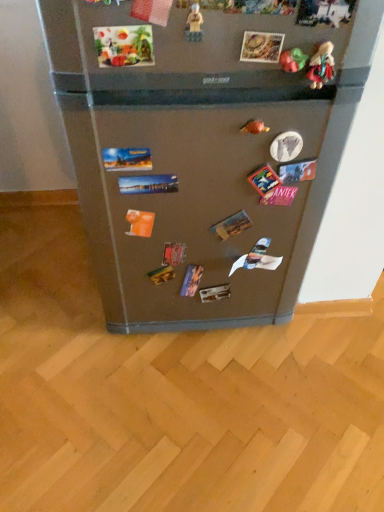
Question: From the image's perspective, is translucent plastic toy at upper center, the first toy positioned from the front, above or below matte plastic doll at upper right, which ranks as the 1th toy in right-to-left order?

Choices:
 (A) above
 (B) below

Answer: (A)

Question: Is point (195, 22) closer or farther from the camera than point (317, 64)?

Choices:
 (A) closer
 (B) farther

Answer: (A)

Question: Estimate the real-world distances between objects in this image. Which object is closer to the rubber duck at upper right, marked as the 1th toy in a back-to-front arrangement?

Choices:
 (A) matte plastic toy at upper right, placed as the second toy when sorted from back to front
 (B) satin silver fridge at center
 (C) matte plastic doll at upper right, which is the 2th toy in front-to-back order
 (D) translucent plastic toy at upper center, arranged as the 4th toy when viewed from the back

Answer: (A)

Question: Estimate the real-world distances between objects in this image. Which object is farther from the matte plastic toy at upper right, the 3th toy in the left-to-right sequence?

Choices:
 (A) satin silver fridge at center
 (B) matte plastic doll at upper right, acting as the fourth toy starting from the left
 (C) rubber duck at upper right, placed as the fourth toy when sorted from front to back
 (D) translucent plastic toy at upper center, the first toy positioned from the front

Answer: (A)